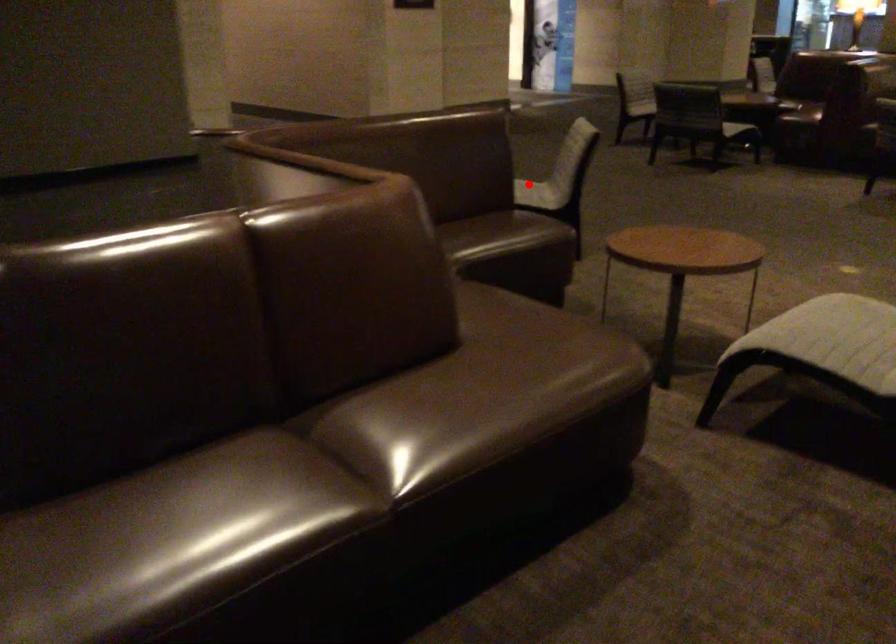
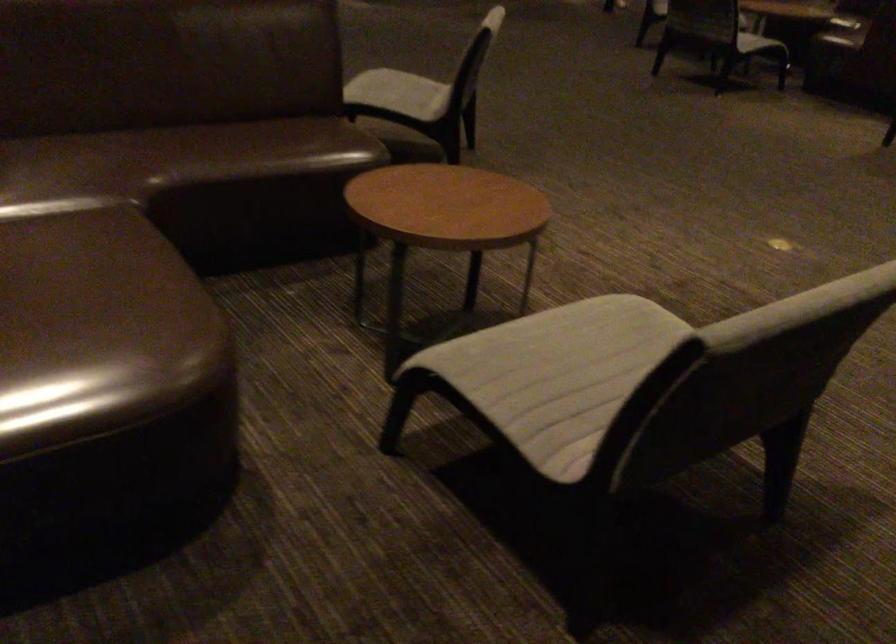
Find the pixel in the second image that matches the highlighted location in the first image.

(399, 93)